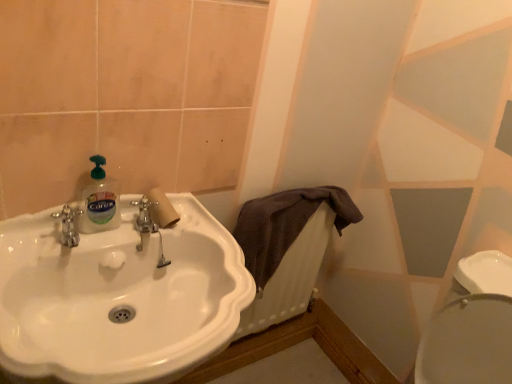
Question: Does white glossy sink at center have a larger size compared to brown fabric radiator at center?

Choices:
 (A) no
 (B) yes

Answer: (B)

Question: Could you tell me if white glossy sink at center is facing brown fabric radiator at center?

Choices:
 (A) no
 (B) yes

Answer: (A)

Question: Is white glossy sink at center not near brown fabric radiator at center?

Choices:
 (A) no
 (B) yes

Answer: (A)

Question: From a real-world perspective, is white glossy sink at center positioned over brown fabric radiator at center based on gravity?

Choices:
 (A) no
 (B) yes

Answer: (A)

Question: From a real-world perspective, is white glossy sink at center under brown fabric radiator at center?

Choices:
 (A) no
 (B) yes

Answer: (B)

Question: Considering the relative sizes of white glossy sink at center and brown fabric radiator at center in the image provided, is white glossy sink at center taller than brown fabric radiator at center?

Choices:
 (A) no
 (B) yes

Answer: (B)

Question: Can we say brown fabric radiator at center lies outside white glossy sink at center?

Choices:
 (A) yes
 (B) no

Answer: (A)

Question: Is brown fabric radiator at center positioned with its back to white glossy sink at center?

Choices:
 (A) no
 (B) yes

Answer: (A)

Question: Can you confirm if brown fabric radiator at center is positioned to the right of white glossy sink at center?

Choices:
 (A) no
 (B) yes

Answer: (B)

Question: Is brown fabric radiator at center far from white glossy sink at center?

Choices:
 (A) no
 (B) yes

Answer: (A)

Question: Is the position of brown fabric radiator at center less distant than that of white glossy sink at center?

Choices:
 (A) no
 (B) yes

Answer: (A)

Question: Is brown fabric radiator at center in contact with white glossy sink at center?

Choices:
 (A) no
 (B) yes

Answer: (A)

Question: Is there a large distance between brown fabric radiator at center and translucent plastic bottle at sink left?

Choices:
 (A) yes
 (B) no

Answer: (B)